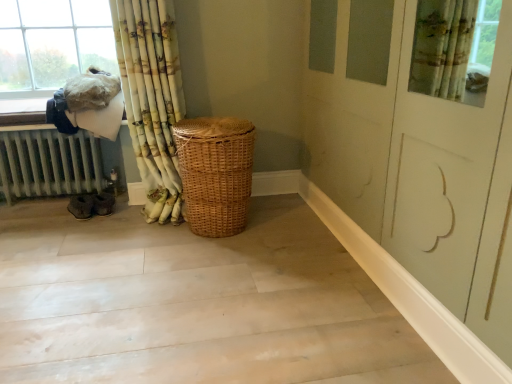
Where is `vacant region to the right of woven natural basket at center`? This screenshot has width=512, height=384. vacant region to the right of woven natural basket at center is located at coordinates (290, 231).